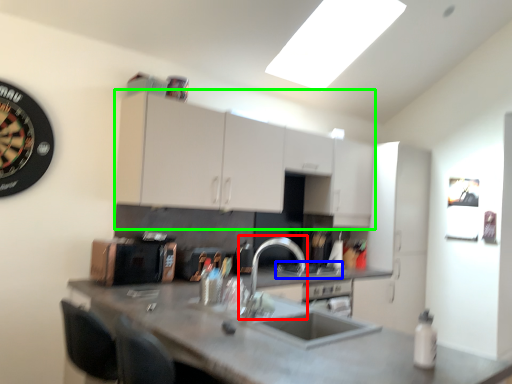
Question: Which is nearer to the faucet (highlighted by a red box)? gas stove (highlighted by a blue box) or cabinetry (highlighted by a green box).

Choices:
 (A) gas stove
 (B) cabinetry

Answer: (A)